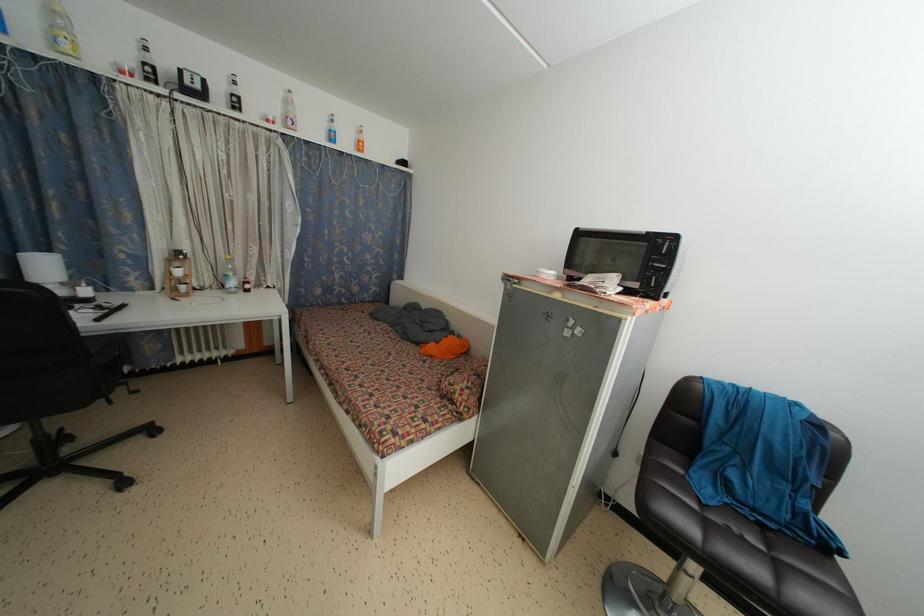
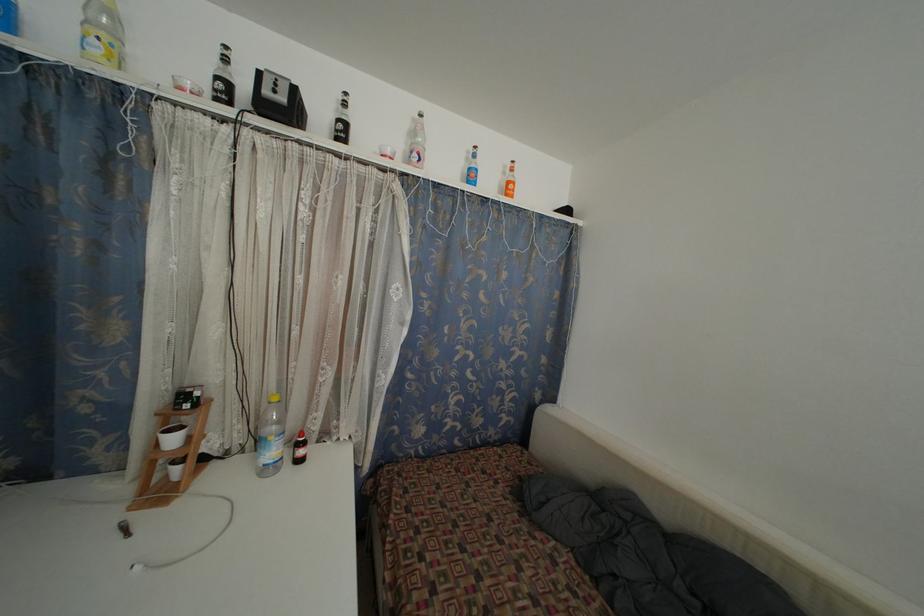
The point at (238, 105) is marked in the first image. Where is the corresponding point in the second image?

(345, 132)